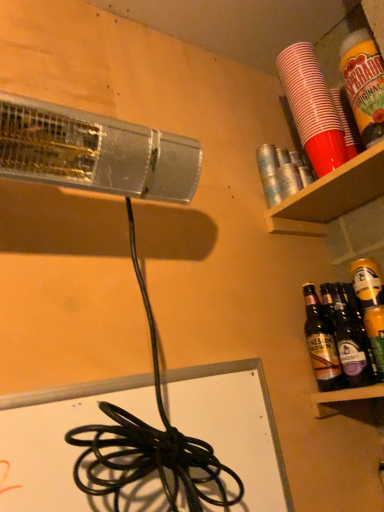
Question: From a real-world perspective, is gold matte can at right physically above red plastic cups at upper right, the 2th beverage positioned from the front?

Choices:
 (A) yes
 (B) no

Answer: (B)

Question: Considering the relative sizes of gold matte can at right and red plastic cups at upper right, which appears as the first beverage when viewed from the back, in the image provided, is gold matte can at right shorter than red plastic cups at upper right, which appears as the first beverage when viewed from the back,?

Choices:
 (A) yes
 (B) no

Answer: (A)

Question: Is gold matte can at right positioned far away from red plastic cups at upper right, which appears as the first beverage when viewed from the back?

Choices:
 (A) yes
 (B) no

Answer: (B)

Question: Is gold matte can at right wider than red plastic cups at upper right, the 2th beverage positioned from the front?

Choices:
 (A) yes
 (B) no

Answer: (B)

Question: Can you confirm if gold matte can at right is positioned to the left of red plastic cups at upper right, the 2th beverage positioned from the front?

Choices:
 (A) no
 (B) yes

Answer: (A)

Question: Is gold matte can at right in front of red plastic cups at upper right, which appears as the first beverage when viewed from the back?

Choices:
 (A) no
 (B) yes

Answer: (B)

Question: Is gold matte can at right looking in the opposite direction of orange plastic cup at upper right, the second beverage positioned from the back?

Choices:
 (A) yes
 (B) no

Answer: (B)

Question: Considering the relative sizes of gold matte can at right and orange plastic cup at upper right, the second beverage positioned from the back, in the image provided, is gold matte can at right shorter than orange plastic cup at upper right, the second beverage positioned from the back,?

Choices:
 (A) yes
 (B) no

Answer: (A)

Question: From a real-world perspective, is gold matte can at right physically below orange plastic cup at upper right, the second beverage positioned from the back?

Choices:
 (A) yes
 (B) no

Answer: (A)

Question: Does gold matte can at right appear on the right side of orange plastic cup at upper right, the second beverage positioned from the back?

Choices:
 (A) no
 (B) yes

Answer: (B)

Question: Is gold matte can at right closer to the viewer compared to orange plastic cup at upper right, the second beverage positioned from the back?

Choices:
 (A) no
 (B) yes

Answer: (A)

Question: From a real-world perspective, is gold matte can at right over orange plastic cup at upper right, which is counted as the 1th beverage, starting from the front?

Choices:
 (A) yes
 (B) no

Answer: (B)

Question: Considering the relative sizes of brown glass bottles at right, arranged as the first bottle when viewed from the left, and dark brown glass bottle at lower right, the first bottle from the right, in the image provided, is brown glass bottles at right, arranged as the first bottle when viewed from the left, bigger than dark brown glass bottle at lower right, the first bottle from the right,?

Choices:
 (A) yes
 (B) no

Answer: (A)